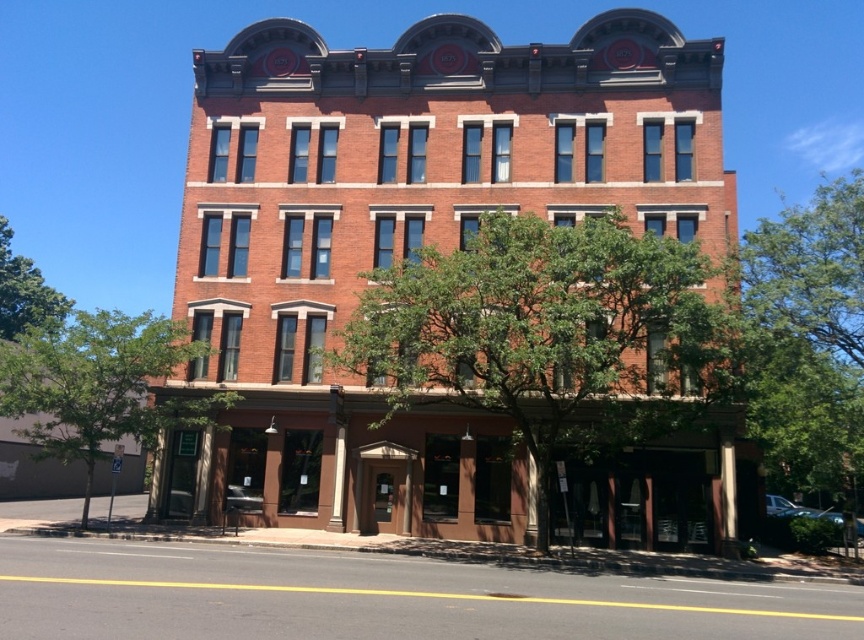
Between green leafy tree at center and green leafy tree at upper right, which one has more height?

green leafy tree at upper right is taller.

Is point (683, 282) in front of point (861, 216)?

Yes, it is in front of point (861, 216).

Find the location of a particular element. green leafy tree at center is located at coordinates (551, 333).

Can you confirm if green leafy tree at center is taller than green leafy tree at left?

No, green leafy tree at center is not taller than green leafy tree at left.

Identify the location of green leafy tree at center. (551, 333).

Who is more forward, (448, 328) or (17, 291)?

Positioned in front is point (448, 328).

This screenshot has height=640, width=864. I want to click on green leafy tree at center, so click(x=551, y=333).

Is point (68, 413) less distant than point (834, 352)?

No, (68, 413) is behind (834, 352).

Does green leafy tree at lower left appear on the left side of green leafy tree at upper right?

Indeed, green leafy tree at lower left is positioned on the left side of green leafy tree at upper right.

Does point (126, 353) lie in front of point (826, 209)?

Yes, point (126, 353) is closer to viewer.

Locate an element on the screen. green leafy tree at lower left is located at coordinates (100, 385).